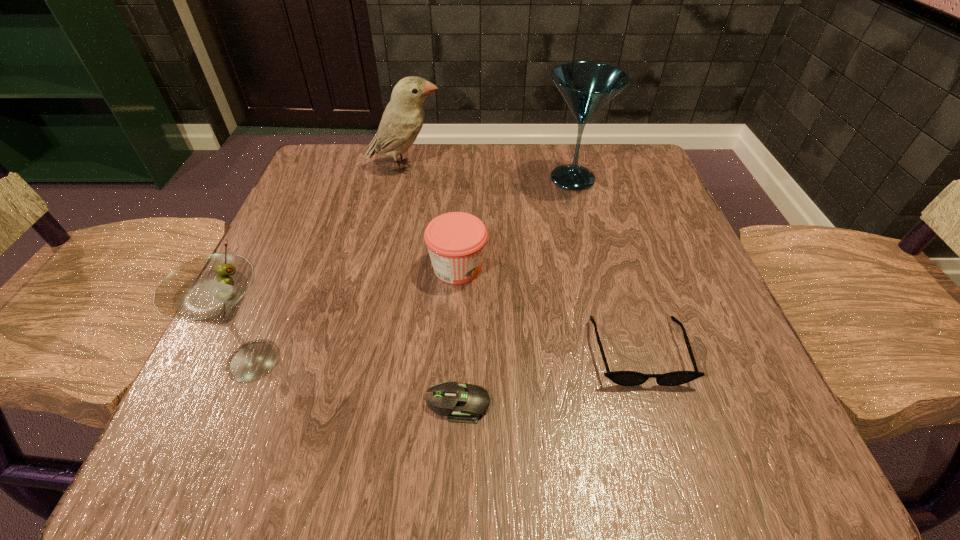
What are the coordinates of `blank area located at the face of the bird` in the screenshot? It's located at (580, 167).

Where is `vacant region located on the back of the leftmost object`? This screenshot has height=540, width=960. vacant region located on the back of the leftmost object is located at coordinates (310, 226).

The image size is (960, 540). I want to click on vacant space located 0.330m on the front label of the third shortest object, so click(x=675, y=267).

Find the location of `free spot located 0.080m on the front-facing side of the second shortest object`. free spot located 0.080m on the front-facing side of the second shortest object is located at coordinates (665, 442).

Identify the location of free region located on the right of the shortest object. (712, 403).

I want to click on martini at the far edge, so click(x=586, y=86).

Where is `bird present at the far edge`? bird present at the far edge is located at coordinates (402, 120).

Where is `object that is at the near edge`? The image size is (960, 540). object that is at the near edge is located at coordinates (464, 403).

Where is `bird at the left edge`? bird at the left edge is located at coordinates (402, 120).

The image size is (960, 540). I want to click on martini at the left edge, so click(x=210, y=289).